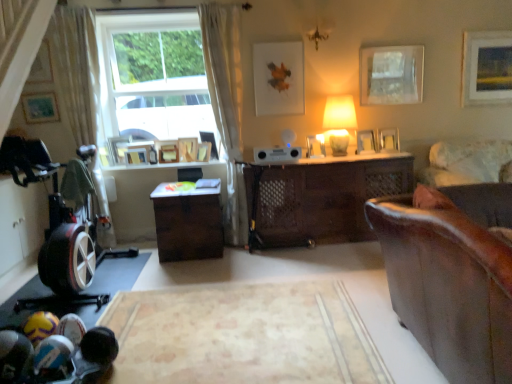
Question: Is wooden picture frame at upper center, placed as the 7th picture frame when sorted from right to left, outside velvet beige couch at right, arranged as the 2th studio couch when viewed from the front?

Choices:
 (A) yes
 (B) no

Answer: (A)

Question: Does wooden picture frame at upper center, placed as the 7th picture frame when sorted from right to left, come in front of velvet beige couch at right, arranged as the 2th studio couch when viewed from the front?

Choices:
 (A) no
 (B) yes

Answer: (A)

Question: From the image's perspective, is wooden picture frame at upper center, which ranks as the eighth picture frame in left-to-right order, located above velvet beige couch at right, the 1th studio couch in the back-to-front sequence?

Choices:
 (A) no
 (B) yes

Answer: (B)

Question: Is wooden picture frame at upper center, which ranks as the eighth picture frame in left-to-right order, further to the viewer compared to velvet beige couch at right, the 1th studio couch in the back-to-front sequence?

Choices:
 (A) no
 (B) yes

Answer: (B)

Question: Are wooden picture frame at upper center, which ranks as the eighth picture frame in left-to-right order, and velvet beige couch at right, the 1th studio couch in the back-to-front sequence, beside each other?

Choices:
 (A) no
 (B) yes

Answer: (A)

Question: Can you confirm if wooden picture frame at upper center, which ranks as the eighth picture frame in left-to-right order, is taller than velvet beige couch at right, the 1th studio couch in the back-to-front sequence?

Choices:
 (A) yes
 (B) no

Answer: (B)

Question: Does wooden picture frame at upper right, positioned as the 2th picture frame in right-to-left order, have a greater height compared to wooden picture frame at upper center, acting as the fifth picture frame starting from the left?

Choices:
 (A) no
 (B) yes

Answer: (B)

Question: Considering the relative sizes of wooden picture frame at upper right, positioned as the 2th picture frame in right-to-left order, and wooden picture frame at upper center, which is the tenth picture frame from right to left, in the image provided, is wooden picture frame at upper right, positioned as the 2th picture frame in right-to-left order, wider than wooden picture frame at upper center, which is the tenth picture frame from right to left,?

Choices:
 (A) no
 (B) yes

Answer: (A)

Question: Considering the relative sizes of wooden picture frame at upper right, positioned as the 2th picture frame in right-to-left order, and wooden picture frame at upper center, acting as the fifth picture frame starting from the left, in the image provided, is wooden picture frame at upper right, positioned as the 2th picture frame in right-to-left order, shorter than wooden picture frame at upper center, acting as the fifth picture frame starting from the left,?

Choices:
 (A) no
 (B) yes

Answer: (A)

Question: Does wooden picture frame at upper right, which ranks as the thirteenth picture frame in left-to-right order, have a lesser width compared to wooden picture frame at upper center, acting as the fifth picture frame starting from the left?

Choices:
 (A) yes
 (B) no

Answer: (A)

Question: Does wooden picture frame at upper right, positioned as the 2th picture frame in right-to-left order, contain wooden picture frame at upper center, acting as the fifth picture frame starting from the left?

Choices:
 (A) no
 (B) yes

Answer: (A)

Question: Is wooden picture frame at upper right, which ranks as the thirteenth picture frame in left-to-right order, aimed at wooden picture frame at upper center, acting as the fifth picture frame starting from the left?

Choices:
 (A) yes
 (B) no

Answer: (B)

Question: From the image's perspective, is matte white lampshade at center-right over wooden picture frame at center, the eleventh picture frame viewed from the left?

Choices:
 (A) yes
 (B) no

Answer: (A)